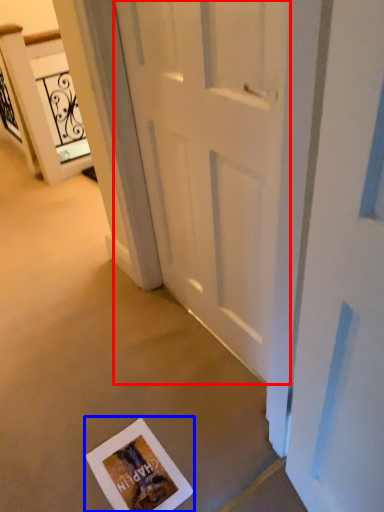
Question: Which object is closer to the camera taking this photo, door (highlighted by a red box) or postcard (highlighted by a blue box)?

Choices:
 (A) door
 (B) postcard

Answer: (A)